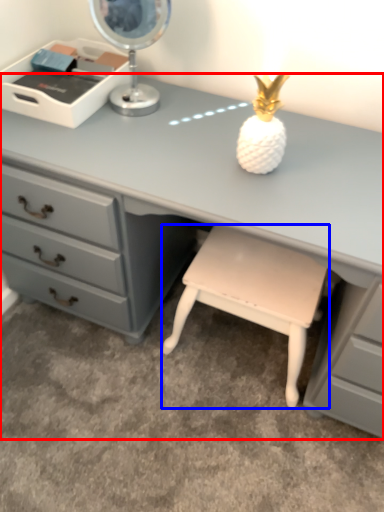
Question: Which object appears farthest to the camera in this image, desk (highlighted by a red box) or stool (highlighted by a blue box)?

Choices:
 (A) desk
 (B) stool

Answer: (B)